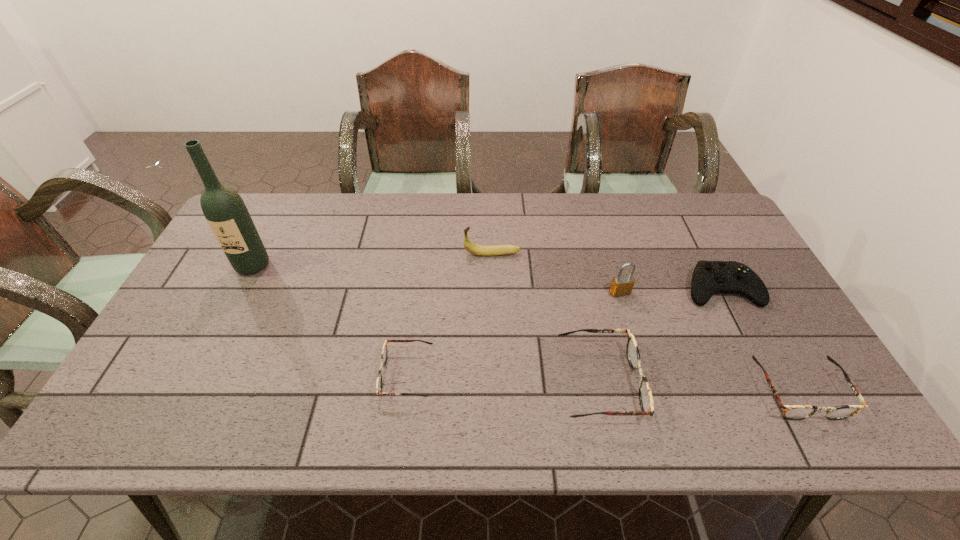
At what (x,y) coordinates should I click in order to perform the action: click on vacant area located 0.150m on the frame of the leftmost spectacles. Please return your answer as a coordinate pair (x, y). Looking at the image, I should click on (320, 374).

This screenshot has width=960, height=540. In order to click on free space located on the frame of the leftmost spectacles in this screenshot , I will do `click(341, 374)`.

The height and width of the screenshot is (540, 960). Identify the location of free region located 0.090m on the frame of the tallest spectacles. (676, 382).

At what (x,y) coordinates should I click in order to perform the action: click on free space located at the stem of the banana. Please return your answer as a coordinate pair (x, y). Looking at the image, I should click on (419, 254).

Locate an element on the screen. Image resolution: width=960 pixels, height=540 pixels. free point located at the stem of the banana is located at coordinates click(x=377, y=254).

This screenshot has height=540, width=960. Identify the location of vacant point located at the stem of the banana. (383, 254).

At what (x,y) coordinates should I click in order to perform the action: click on vacant space located on the back of the control. Please return your answer as a coordinate pair (x, y). Looking at the image, I should click on (x=706, y=258).

Locate an element on the screen. This screenshot has height=540, width=960. free region located on the labeled side of the wine bottle is located at coordinates (212, 345).

I want to click on vacant space located on the back of the padlock, so click(611, 260).

Identify the location of object situated at the left edge. Image resolution: width=960 pixels, height=540 pixels. (225, 211).